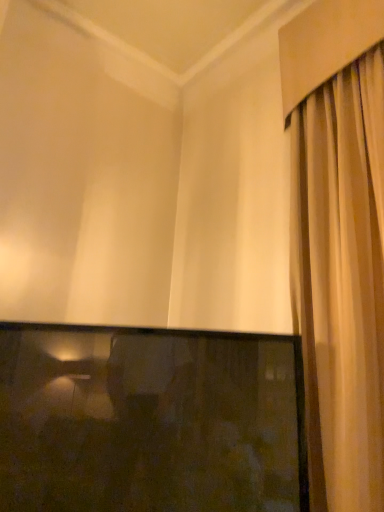
This screenshot has height=512, width=384. What do you see at coordinates (341, 282) in the screenshot? I see `beige fabric curtain at right` at bounding box center [341, 282].

You are a GUI agent. You are given a task and a screenshot of the screen. Output one action in this format:
    pyautogui.click(x=<x>, y=<y>)
    Task: Click on the beige fabric curtain at right
    This screenshot has width=384, height=512.
    Given the screenshot: What is the action you would take?
    tap(341, 282)

Looking at this image, measure the distance between point (x=307, y=375) and camera.

→ 4.73 feet.

Find the location of a particular element. This screenshot has width=384, height=512. beige fabric curtain at right is located at coordinates (341, 282).